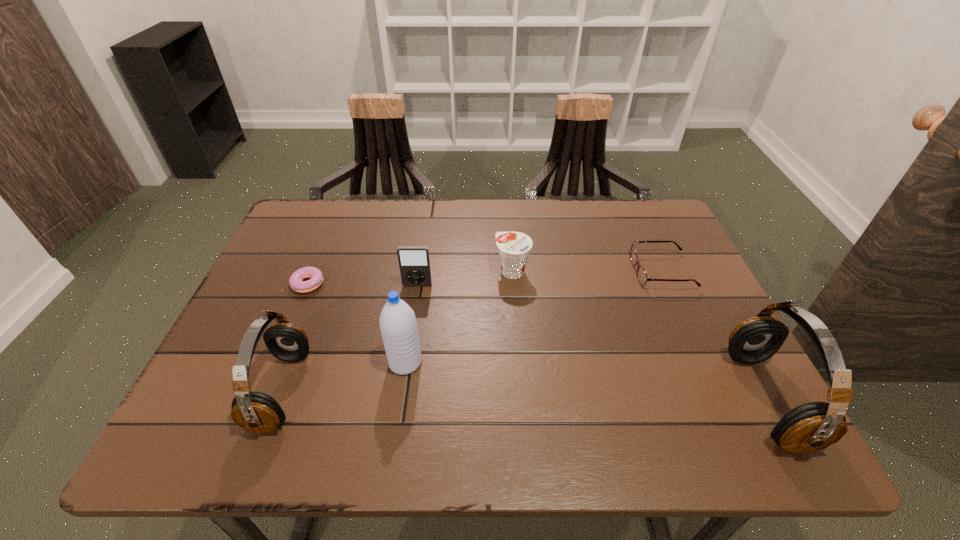
In order to click on the left headset in this screenshot , I will do `click(257, 412)`.

This screenshot has width=960, height=540. I want to click on the shorter headset, so click(257, 412).

This screenshot has width=960, height=540. In order to click on the right headset in this screenshot , I will do `click(813, 426)`.

Image resolution: width=960 pixels, height=540 pixels. Find the location of `yogurt`. yogurt is located at coordinates (514, 247).

This screenshot has height=540, width=960. I want to click on the third shortest object, so click(x=514, y=247).

Where is `iPod`? iPod is located at coordinates (414, 262).

The width and height of the screenshot is (960, 540). I want to click on doughnut, so click(296, 282).

Identify the location of water bottle. (398, 324).

Find the location of `spectacles`. spectacles is located at coordinates (642, 277).

This screenshot has height=540, width=960. In order to click on free space located 0.080m on the ear cups of the shorter headset in this screenshot , I will do `click(343, 391)`.